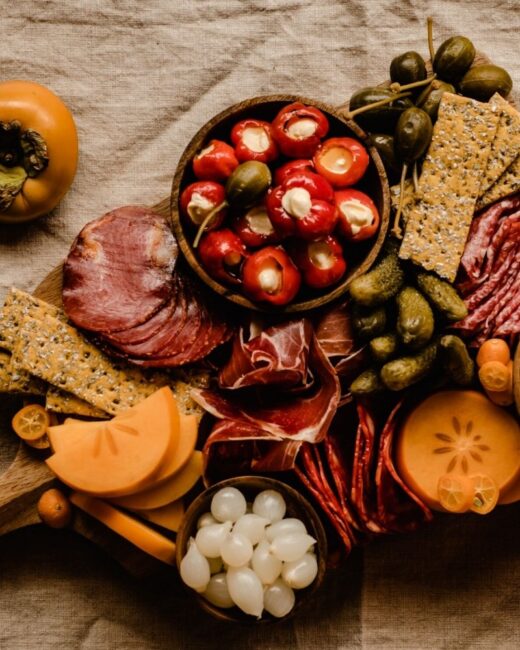
Locate an element on the screen. wooden board is located at coordinates (x=21, y=480).